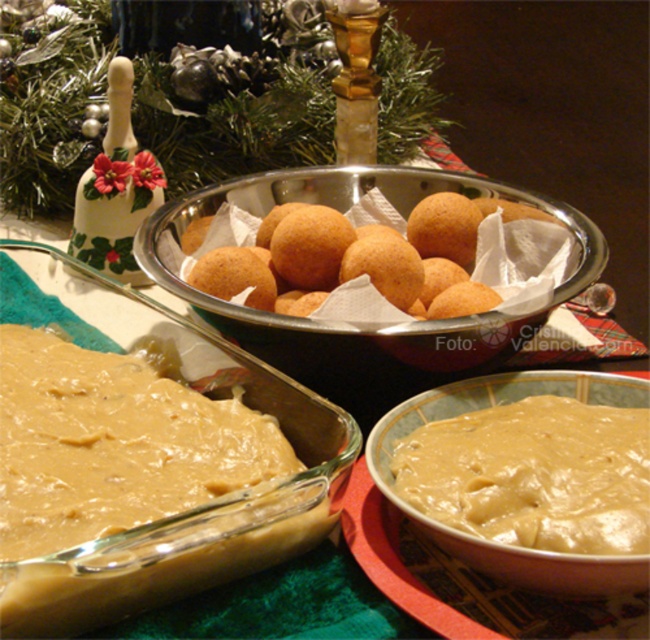
Question: Which point is closer to the camera?

Choices:
 (A) metallic silver bowl at center
 (B) smooth beige paste at lower left
 (C) creamy smooth pudding at center

Answer: (B)

Question: Does smooth beige paste at lower left come behind golden crispy balls at center?

Choices:
 (A) yes
 (B) no

Answer: (B)

Question: Is golden crispy balls at center closer to the viewer compared to metallic silver bowl at center?

Choices:
 (A) yes
 (B) no

Answer: (B)

Question: Which of these objects is positioned closest to the creamy smooth pudding at center?

Choices:
 (A) smooth beige paste at lower left
 (B) metallic silver bowl at center
 (C) golden crispy balls at center

Answer: (A)

Question: Among these points, which one is nearest to the camera?

Choices:
 (A) (3, 422)
 (B) (601, 257)
 (C) (313, 298)

Answer: (A)

Question: Is golden crispy balls at center bigger than metallic silver bowl at center?

Choices:
 (A) yes
 (B) no

Answer: (B)